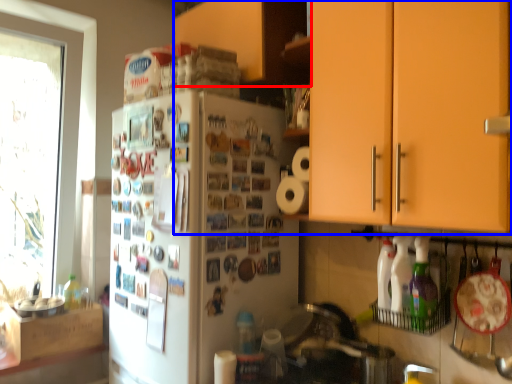
Question: Which object appears closest to the camera in this image, cabinetry (highlighted by a red box) or cabinetry (highlighted by a blue box)?

Choices:
 (A) cabinetry
 (B) cabinetry

Answer: (B)